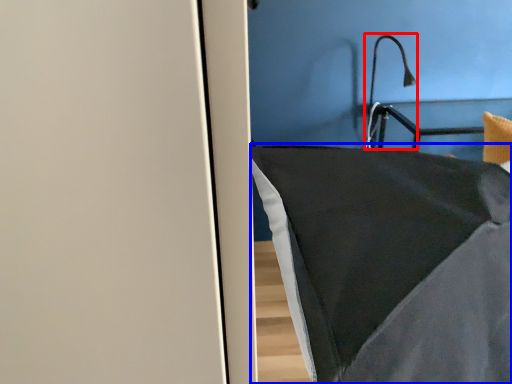
Question: Which point is further to the camera, light fixture (highlighted by a red box) or furniture (highlighted by a blue box)?

Choices:
 (A) light fixture
 (B) furniture

Answer: (A)